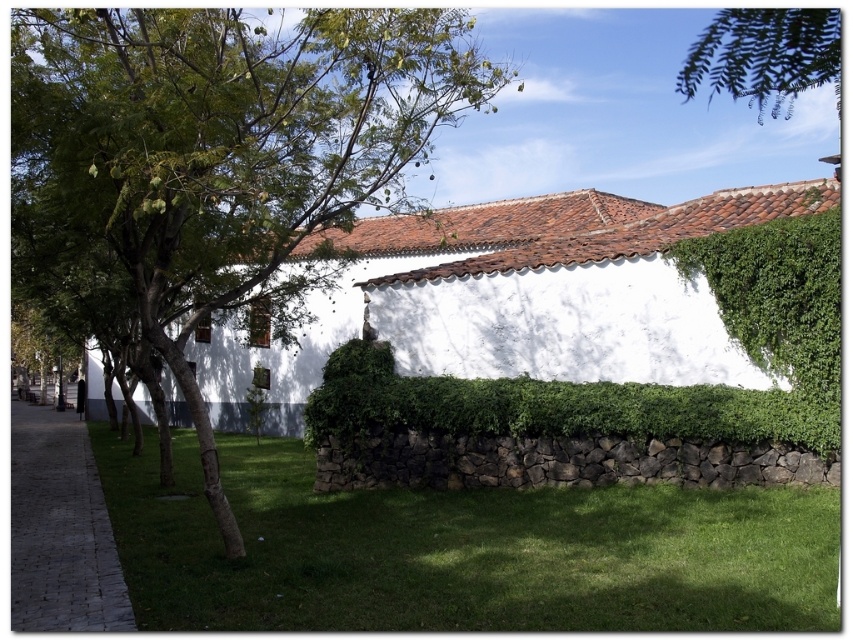
Question: Among these objects, which one is farthest from the camera?

Choices:
 (A) paved stone sidewalk at lower left
 (B) green leafy branch at upper right
 (C) green grass at lower center

Answer: (A)

Question: Estimate the real-world distances between objects in this image. Which object is farther from the green leafy hedge at center?

Choices:
 (A) green grass at lower center
 (B) green leafy tree at center

Answer: (B)

Question: Is green leafy tree at center thinner than green leafy branch at upper right?

Choices:
 (A) no
 (B) yes

Answer: (B)

Question: Can you confirm if green grass at lower center is thinner than paved stone sidewalk at lower left?

Choices:
 (A) no
 (B) yes

Answer: (B)

Question: Which object appears farthest from the camera in this image?

Choices:
 (A) green leafy tree at center
 (B) paved stone sidewalk at lower left

Answer: (B)

Question: Is green grass at lower center above green leafy branch at upper right?

Choices:
 (A) no
 (B) yes

Answer: (A)